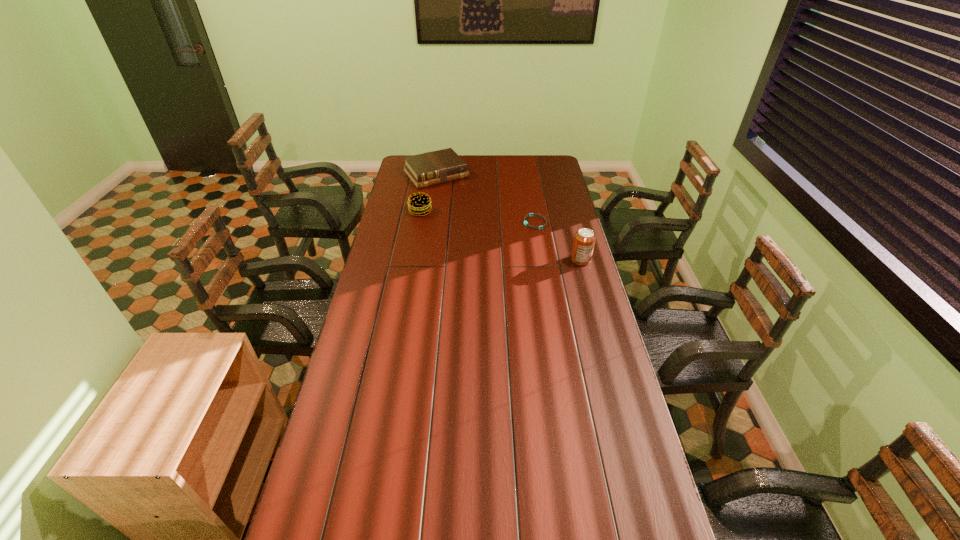
Identify the location of patty. Image resolution: width=960 pixels, height=540 pixels. (419, 204).

This screenshot has height=540, width=960. I want to click on can, so click(x=584, y=240).

You are a GUI agent. You are given a task and a screenshot of the screen. Output one action in this format:
    pyautogui.click(x=<x>, y=<y>)
    Task: Click on the tallest object
    Image resolution: width=960 pixels, height=540 pixels.
    Given the screenshot: What is the action you would take?
    pyautogui.click(x=584, y=240)

I want to click on the farthest object, so click(x=437, y=167).

Where is `the third object from left to right`? the third object from left to right is located at coordinates (530, 214).

Locate an element on the screen. wristband is located at coordinates (530, 214).

Where is `vacant region located 0.160m on the back of the patty`? The width and height of the screenshot is (960, 540). vacant region located 0.160m on the back of the patty is located at coordinates (424, 189).

Identify the location of blank space located 0.390m on the front of the tallest object. The width and height of the screenshot is (960, 540). (602, 337).

At what (x,y) coordinates should I click in order to perform the action: click on blank area located on the spine side of the farthest object. Please return your answer as a coordinate pair (x, y). The image size is (960, 540). Looking at the image, I should click on (474, 216).

Image resolution: width=960 pixels, height=540 pixels. I want to click on free region located on the spine side of the farthest object, so click(x=468, y=210).